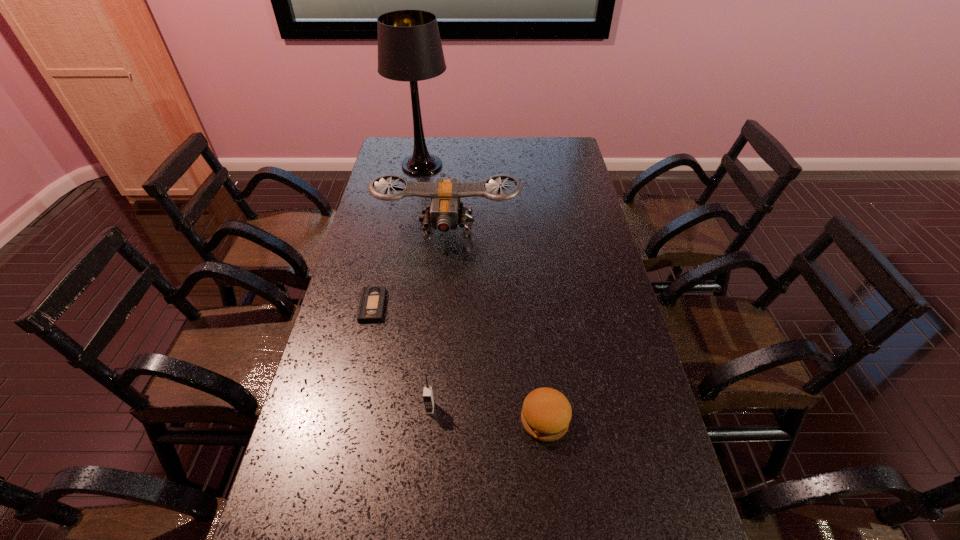
Where is `vacant space at the right edge`? The height and width of the screenshot is (540, 960). vacant space at the right edge is located at coordinates [588, 260].

Where is `vacant space at the far left corner of the desktop`? vacant space at the far left corner of the desktop is located at coordinates (398, 156).

Image resolution: width=960 pixels, height=540 pixels. Find the location of `vacant space that is in between the table lamp and the third shortest object`. vacant space that is in between the table lamp and the third shortest object is located at coordinates (426, 287).

The image size is (960, 540). Find the location of `free space between the third farthest object and the cellular telephone`. free space between the third farthest object and the cellular telephone is located at coordinates (401, 357).

Locate an element on the screen. The height and width of the screenshot is (540, 960). free space between the cellular telephone and the tallest object is located at coordinates (426, 287).

Find the location of a particular element. This screenshot has width=960, height=540. free space between the third farthest object and the cellular telephone is located at coordinates (401, 357).

The width and height of the screenshot is (960, 540). I want to click on free space between the second farthest object and the third farthest object, so [x=410, y=268].

This screenshot has width=960, height=540. I want to click on vacant area that lies between the second tallest object and the hamburger, so click(x=496, y=326).

At what (x,y) coordinates should I click in order to perform the action: click on free spot between the hamburger and the videotape. Please return your answer as a coordinate pair (x, y). Image resolution: width=960 pixels, height=540 pixels. Looking at the image, I should click on (459, 363).

Identify the location of empty location between the cellular telephone and the tallest object. The height and width of the screenshot is (540, 960). pos(426,287).